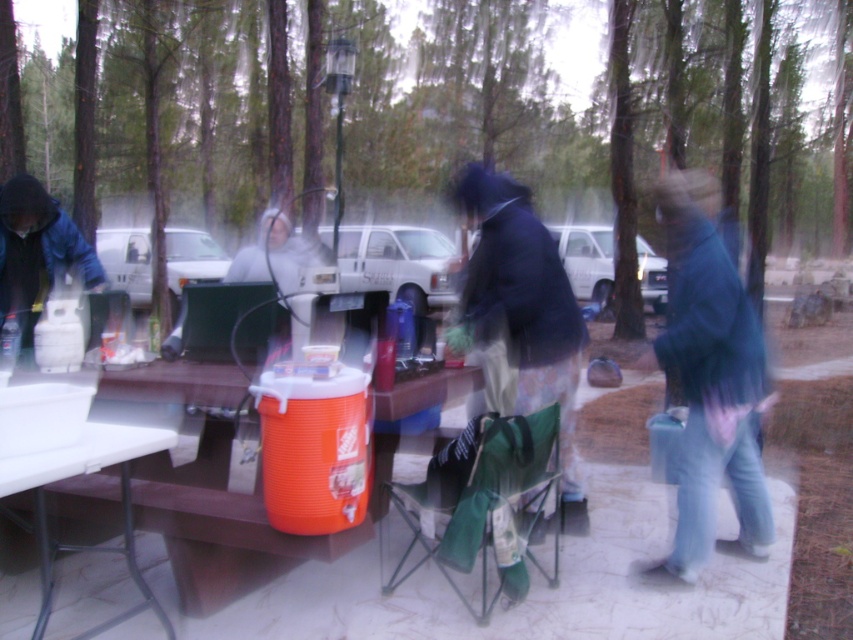
Question: Is the position of blue fuzzy jacket at right more distant than that of white plastic table at lower left?

Choices:
 (A) yes
 (B) no

Answer: (A)

Question: Which object is closer to the camera taking this photo?

Choices:
 (A) dark blue jacket at center
 (B) white plastic table at lower left

Answer: (B)

Question: Which of the following is the closest to the observer?

Choices:
 (A) (688, 442)
 (B) (535, 323)

Answer: (A)

Question: Is blue fuzzy jacket at right smaller than white plastic table at lower left?

Choices:
 (A) yes
 (B) no

Answer: (A)

Question: Can you confirm if blue fuzzy jacket at right is positioned above white plastic table at lower left?

Choices:
 (A) yes
 (B) no

Answer: (A)

Question: Which object appears farthest from the camera in this image?

Choices:
 (A) white plastic table at lower left
 (B) blue fuzzy jacket at right
 (C) dark blue jacket at center

Answer: (B)